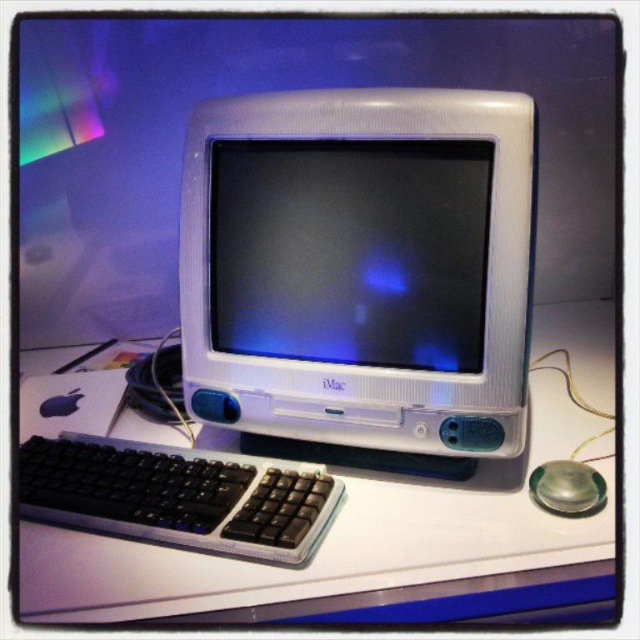
Question: Observing the image, what is the correct spatial positioning of white plastic monitor at center in reference to black plastic keyboard at lower left?

Choices:
 (A) right
 (B) left

Answer: (A)

Question: Estimate the real-world distances between objects in this image. Which object is closer to the black plastic keyboard at lower left?

Choices:
 (A) white glossy monitor at center
 (B) white plastic monitor at center
 (C) white glossy computer desk at center

Answer: (C)

Question: Which object is positioned closest to the black plastic keyboard at lower left?

Choices:
 (A) white glossy computer desk at center
 (B) white plastic monitor at center

Answer: (A)

Question: Which of the following is the closest to the observer?

Choices:
 (A) white glossy computer desk at center
 (B) white plastic monitor at center

Answer: (A)

Question: Where is white glossy computer desk at center located in relation to white glossy monitor at center in the image?

Choices:
 (A) left
 (B) right

Answer: (B)

Question: Does white plastic monitor at center have a lesser width compared to black plastic keyboard at lower left?

Choices:
 (A) yes
 (B) no

Answer: (B)